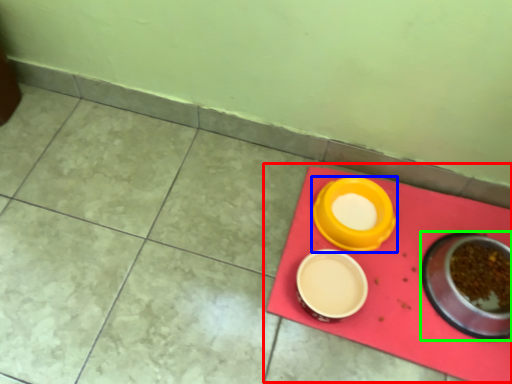
Question: Considering the real-world distances, which object is farthest from table (highlighted by a red box)? tableware (highlighted by a blue box) or tableware (highlighted by a green box)?

Choices:
 (A) tableware
 (B) tableware

Answer: (A)